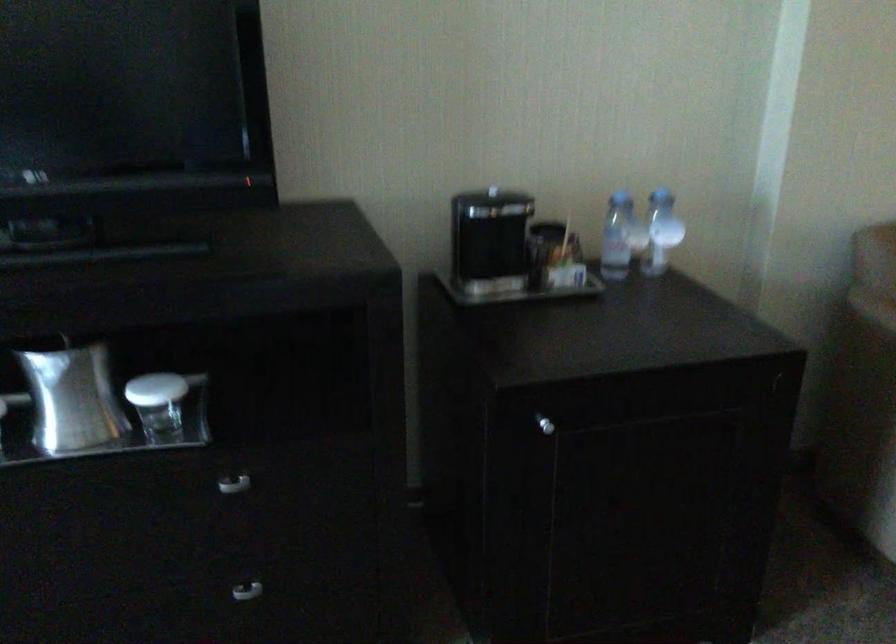
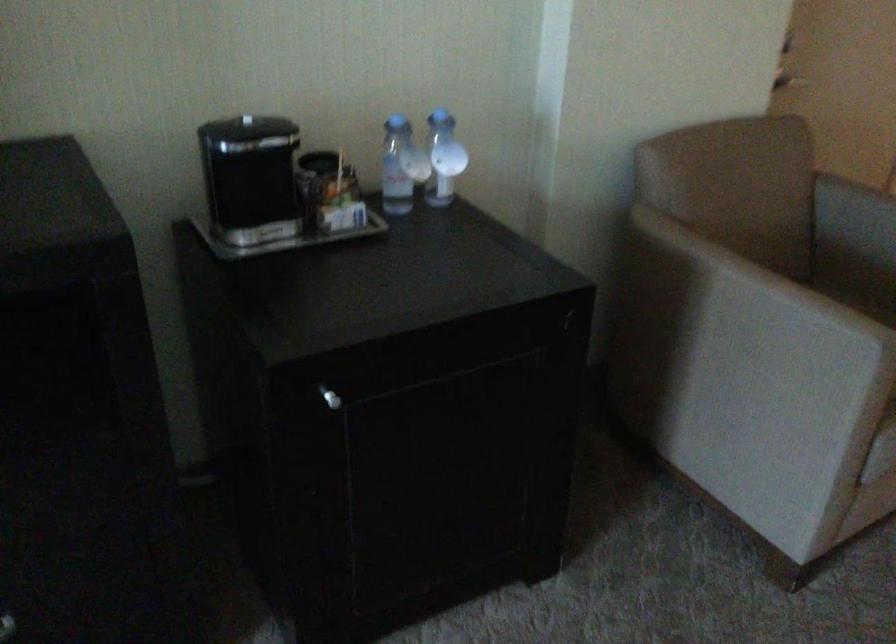
Find the pixel in the second image that matches (621,232) in the first image.

(401, 166)